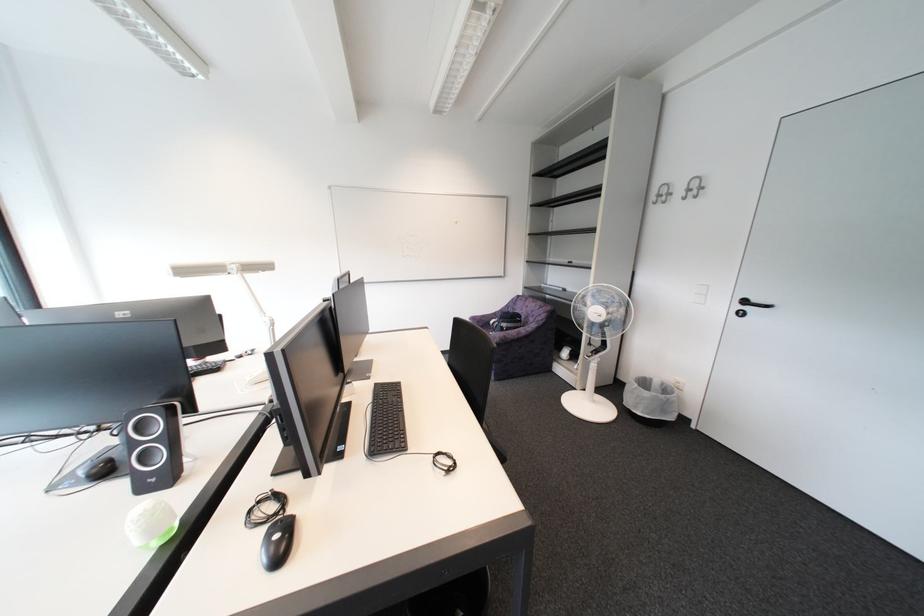
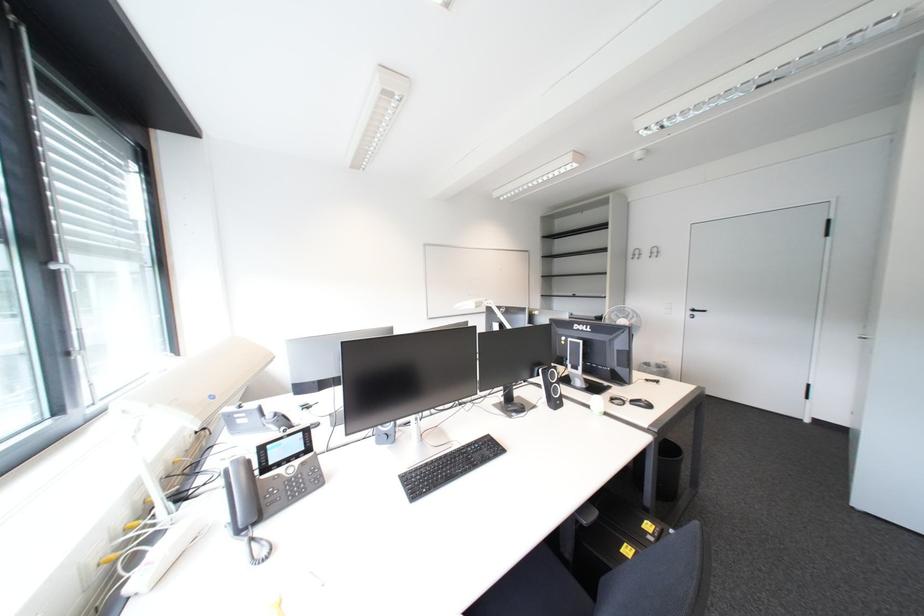
Question: Which direction would the cameraman need to move to produce the second image? Reply with the corresponding letter.

Choices:
 (A) Left
 (B) Right
 (C) Forward
 (D) Backward

Answer: (A)